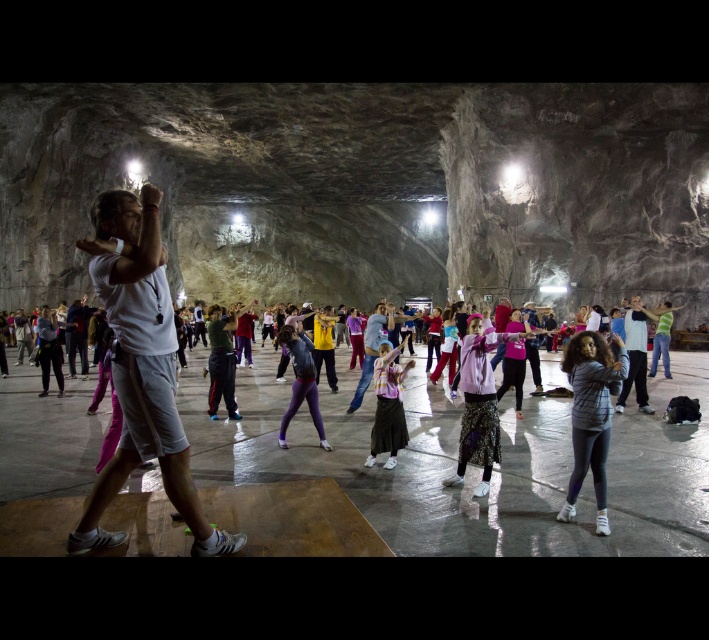
In the scene shown: Which is more to the right, striped fabric skirt at center or green fabric shirt at center?

striped fabric skirt at center is more to the right.

Between point (381, 412) and point (225, 365), which one is positioned in front?

Point (381, 412) is more forward.

Identify the location of striped fabric skirt at center. This screenshot has height=640, width=709. (389, 404).

Is point (474, 380) farther from viewer compared to point (381, 424)?

That is False.

Does pink fabric at center have a greater width compared to striped fabric skirt at center?

Correct, the width of pink fabric at center exceeds that of striped fabric skirt at center.

What do you see at coordinates (479, 401) in the screenshot?
I see `pink fabric at center` at bounding box center [479, 401].

Find the location of a particular element. This screenshot has height=640, width=709. pink fabric at center is located at coordinates (479, 401).

Is pink fabric at center taller than white matte shirt at center?

No, pink fabric at center is not taller than white matte shirt at center.

Who is more forward, (493, 333) or (637, 376)?

Point (493, 333)

Is point (457, 474) less distant than point (636, 365)?

That is True.

This screenshot has width=709, height=640. What are the coordinates of `pink fabric at center` in the screenshot? It's located at (479, 401).